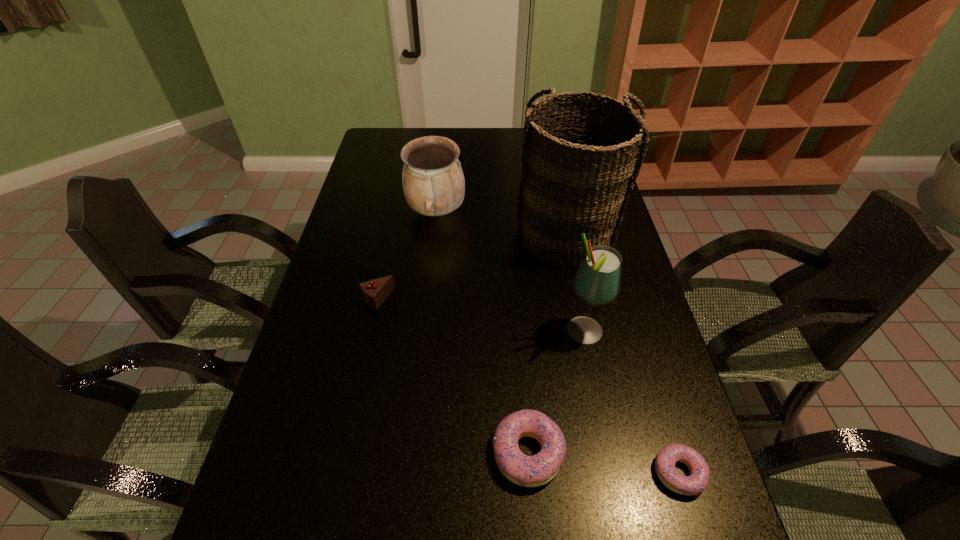
The width and height of the screenshot is (960, 540). Find the location of `free space at the far edge of the desktop`. free space at the far edge of the desktop is located at coordinates (510, 146).

Where is `blank area at the near edge`? blank area at the near edge is located at coordinates (402, 496).

Where is `blank space at the left edge of the desktop`? blank space at the left edge of the desktop is located at coordinates (334, 440).

In order to click on vacant area at the right edge in this screenshot , I will do `click(622, 234)`.

You are a GUI agent. You are given a task and a screenshot of the screen. Output one action in this format:
    pyautogui.click(x=<x>, y=<y>)
    Task: Click on the vacant space at the far left corner of the desktop
    
    Given the screenshot: What is the action you would take?
    pyautogui.click(x=401, y=129)

Locate an element on the screen. The height and width of the screenshot is (540, 960). free spot between the fifth tallest object and the fifth shortest object is located at coordinates (556, 392).

Locate an element on the screen. free space that is in between the second tallest object and the fifth tallest object is located at coordinates (556, 392).

Where is `vacant region between the shortest object and the alcohol`? The image size is (960, 540). vacant region between the shortest object and the alcohol is located at coordinates (632, 402).

The image size is (960, 540). What are the coordinates of `vacant region between the second shortest object and the fourth nearest object` in the screenshot? It's located at (453, 375).

Find the location of a particular element. The image size is (960, 540). vacant area that lies between the urn and the alcohol is located at coordinates (510, 272).